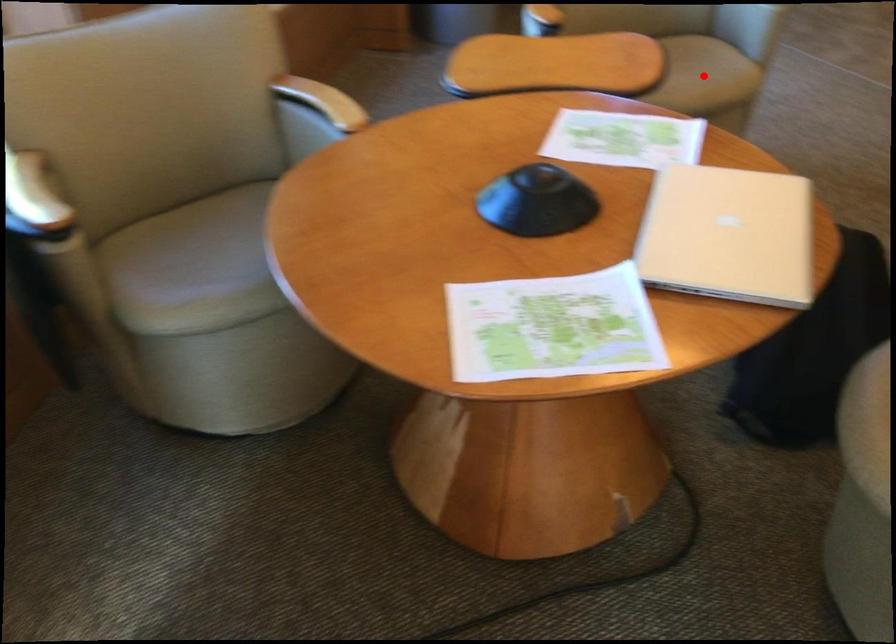
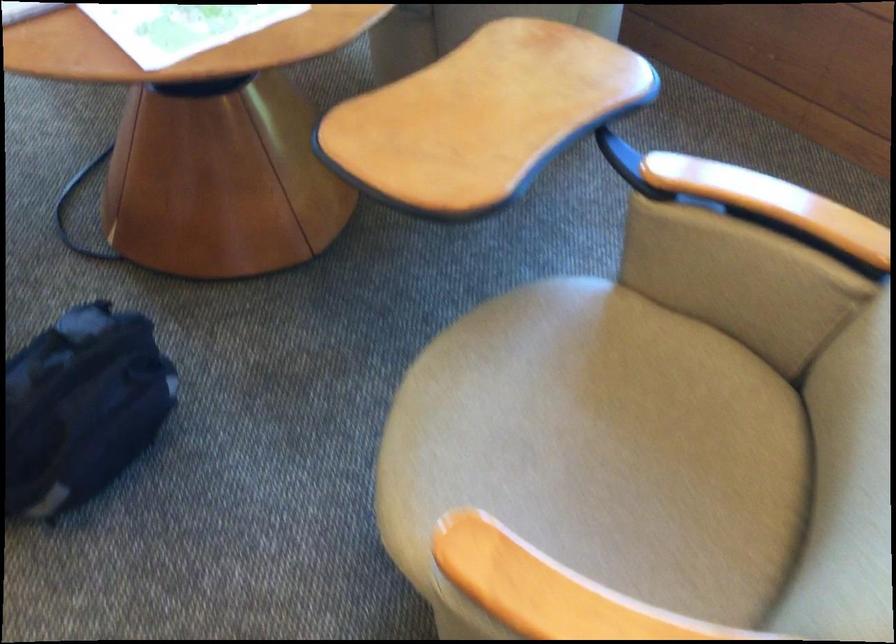
Question: I am providing you with two images of the same scene from different viewpoints. A red point is marked on the first image. Can you still see the location of the red point in image 2?

Choices:
 (A) Yes
 (B) No

Answer: (B)